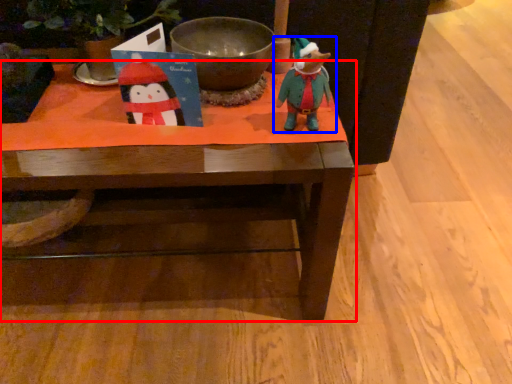
Question: Which object is closer to the camera taking this photo, table (highlighted by a red box) or toy (highlighted by a blue box)?

Choices:
 (A) table
 (B) toy

Answer: (B)